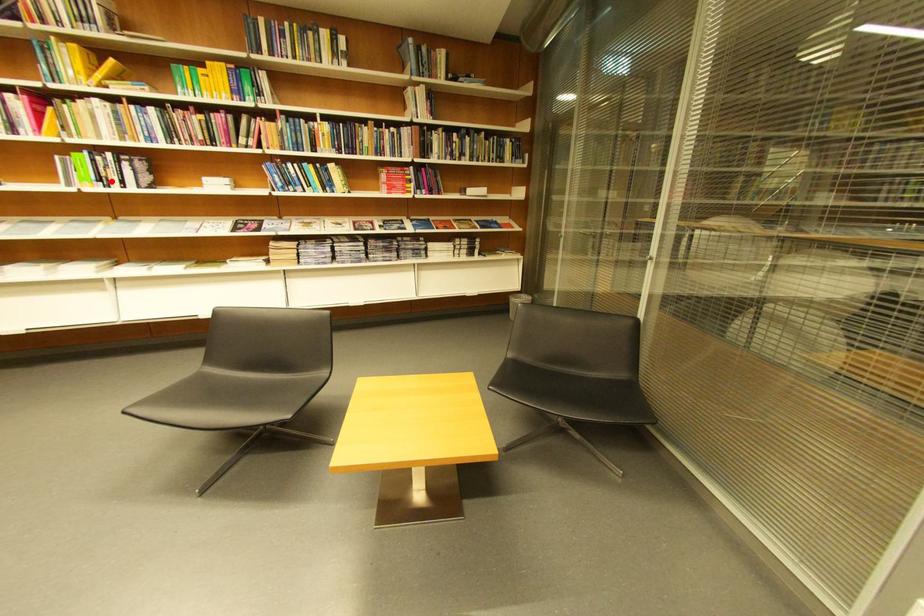
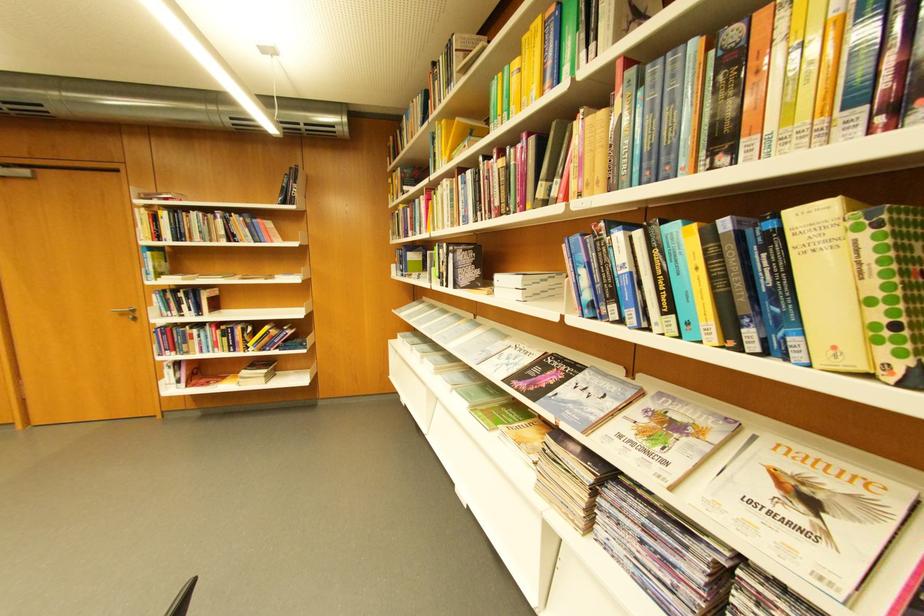
Question: A red point is marked in image1. In image2, is the corresponding 3D point closer to the camera or farther? Reply with the corresponding letter.

Choices:
 (A) The corresponding 3D point is closer.
 (B) The corresponding 3D point is farther.

Answer: (A)